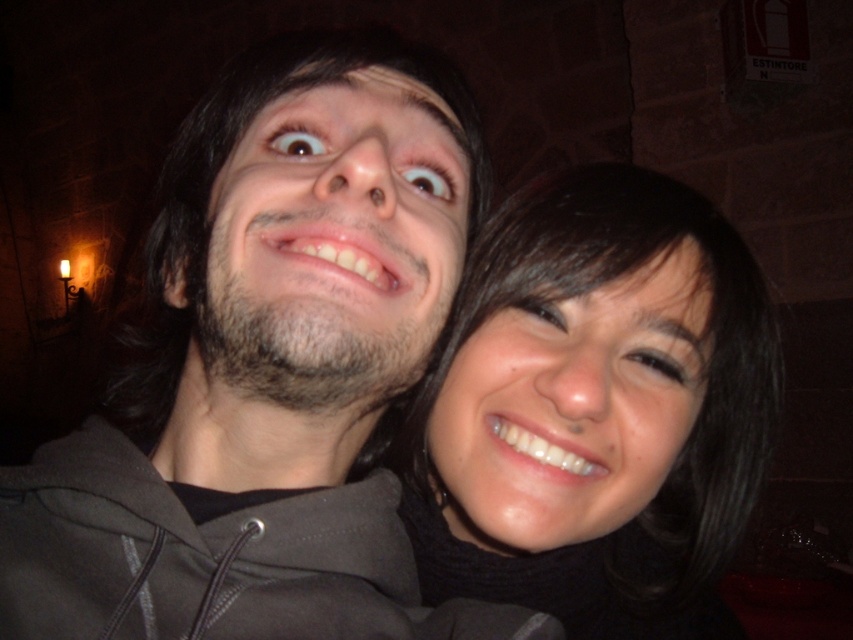
This screenshot has height=640, width=853. What do you see at coordinates (270, 369) in the screenshot? I see `matte black hoodie at center` at bounding box center [270, 369].

Is matte black hoodie at center wider than smooth black hair at center?

Indeed, matte black hoodie at center has a greater width compared to smooth black hair at center.

Does point (337, 227) come behind point (628, 595)?

No, it is not.

Where is `matte black hoodie at center`? matte black hoodie at center is located at coordinates (270, 369).